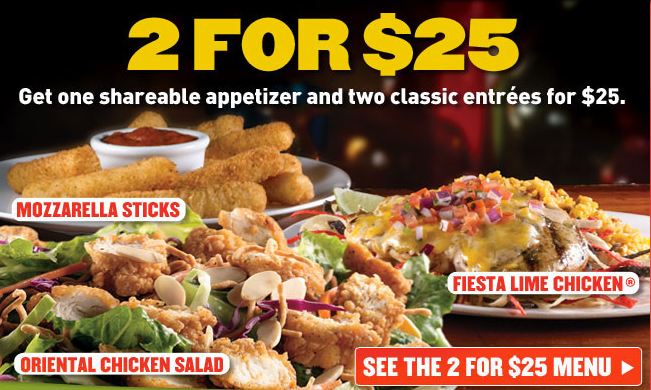
Image resolution: width=651 pixels, height=390 pixels. I want to click on table, so click(622, 200).